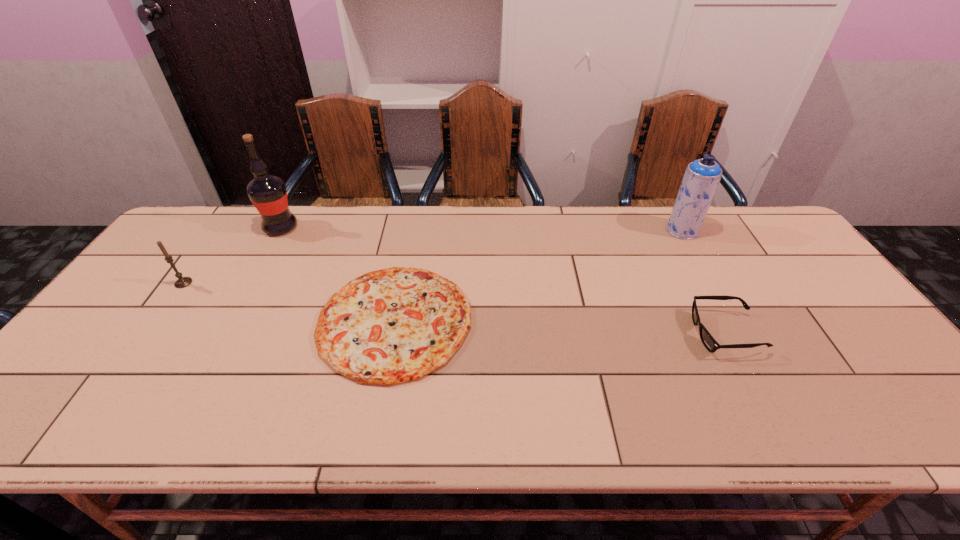
The width and height of the screenshot is (960, 540). In order to click on vacant space located on the back of the leftmost object in this screenshot , I will do `click(196, 266)`.

I want to click on free space located on the front-facing side of the second shortest object, so click(583, 333).

The height and width of the screenshot is (540, 960). I want to click on vacant space located on the front-facing side of the second shortest object, so click(574, 333).

At what (x,y) coordinates should I click in order to perform the action: click on vacant region located on the front-facing side of the second shortest object. Please return your answer as a coordinate pair (x, y). The image size is (960, 540). Looking at the image, I should click on [630, 333].

The image size is (960, 540). Identify the location of free region located on the right of the third object from right to left. (548, 321).

This screenshot has width=960, height=540. In order to click on wine bottle present at the far edge in this screenshot , I will do `click(267, 192)`.

This screenshot has height=540, width=960. In order to click on aerosol can that is at the far edge in this screenshot , I will do `click(702, 176)`.

The width and height of the screenshot is (960, 540). What are the coordinates of `object that is at the left edge` in the screenshot? It's located at (182, 282).

The height and width of the screenshot is (540, 960). What are the coordinates of `free point at the far edge` in the screenshot? It's located at (580, 247).

Locate an element on the screen. The image size is (960, 540). vacant region at the near edge of the desktop is located at coordinates [805, 414].